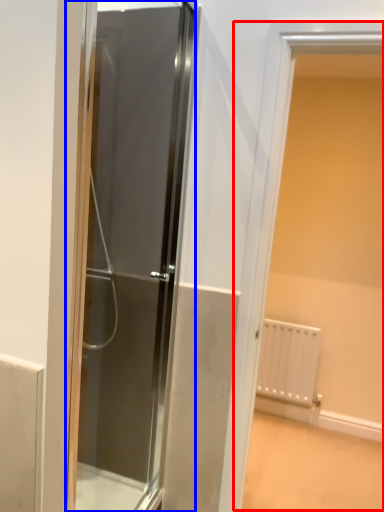
Question: Which object is further to the camera taking this photo, window (highlighted by a red box) or door (highlighted by a blue box)?

Choices:
 (A) window
 (B) door

Answer: (A)